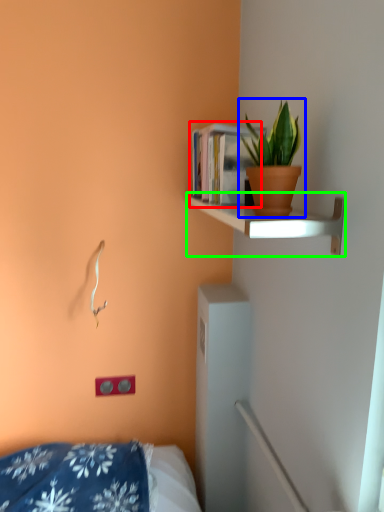
Question: Which object is the farthest from book (highlighted by a red box)? Choose among these: houseplant (highlighted by a blue box) or shelf (highlighted by a green box).

Choices:
 (A) houseplant
 (B) shelf

Answer: (A)